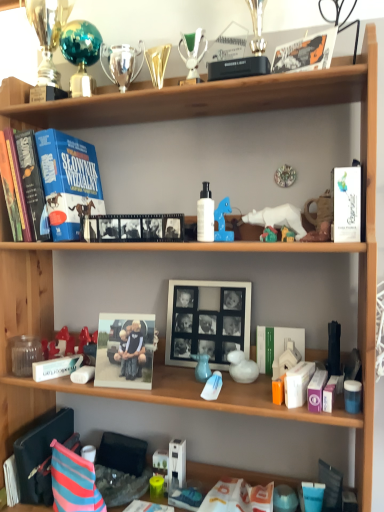
Question: Considering the positions of translucent plastic bag at center, placed as the 5th toy when sorted from left to right, and black matte film strip at upper center, the third magazine when ordered from bottom to top, in the image, is translucent plastic bag at center, placed as the 5th toy when sorted from left to right, taller or shorter than black matte film strip at upper center, the third magazine when ordered from bottom to top,?

Choices:
 (A) tall
 (B) short

Answer: (B)

Question: In terms of size, does translucent plastic bag at center, which is the first toy in bottom-to-top order, appear bigger or smaller than black matte film strip at upper center, placed as the second magazine when sorted from left to right?

Choices:
 (A) big
 (B) small

Answer: (B)

Question: Considering the real-world distances, which object is farthest from the metallic gold trophy at upper center, which is counted as the third toy, starting from the top?

Choices:
 (A) transparent glass jar at lower left
 (B) matte blue vase at center, arranged as the third toy when viewed from the right
 (C) matte plastic photo frame at center, the 2th picture frame in the back-to-front sequence
 (D) white matte bottle at center
 (E) white glossy duck at center, positioned as the third toy in bottom-to-top order

Answer: (A)

Question: Based on their relative distances, which object is farther from the shiny silver trophy at upper center, the fifth toy when ordered from bottom to top?

Choices:
 (A) matte plastic photo frame at center, marked as the 1th picture frame in a left-to-right arrangement
 (B) transparent glass jar at lower left
 (C) white matte picture frame at center, which appears as the 2th picture frame when viewed from the left
 (D) metallic gold trophy at upper center, the 4th toy ordered from the bottom
 (E) black plastic magazine at lower left, which is the 1th magazine from bottom to top

Answer: (E)